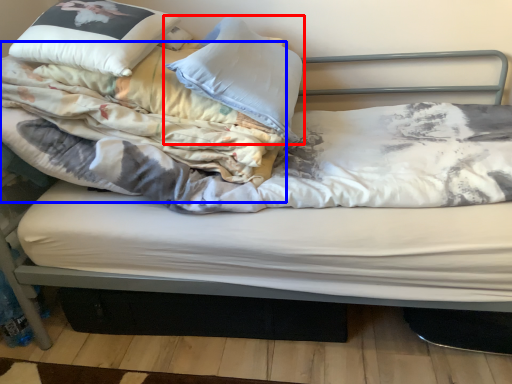
Question: Which object appears closest to the camera in this image, pillow (highlighted by a red box) or blanket (highlighted by a blue box)?

Choices:
 (A) pillow
 (B) blanket

Answer: (B)